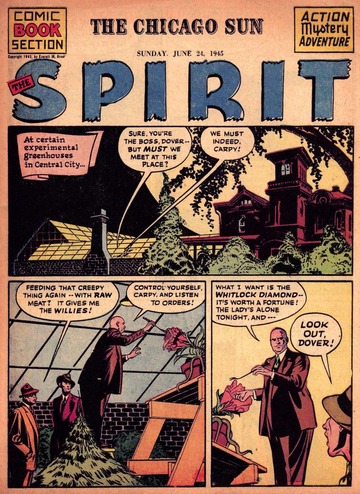
Find the location of a particular element. This screenshot has height=494, width=360. table is located at coordinates (193, 459).